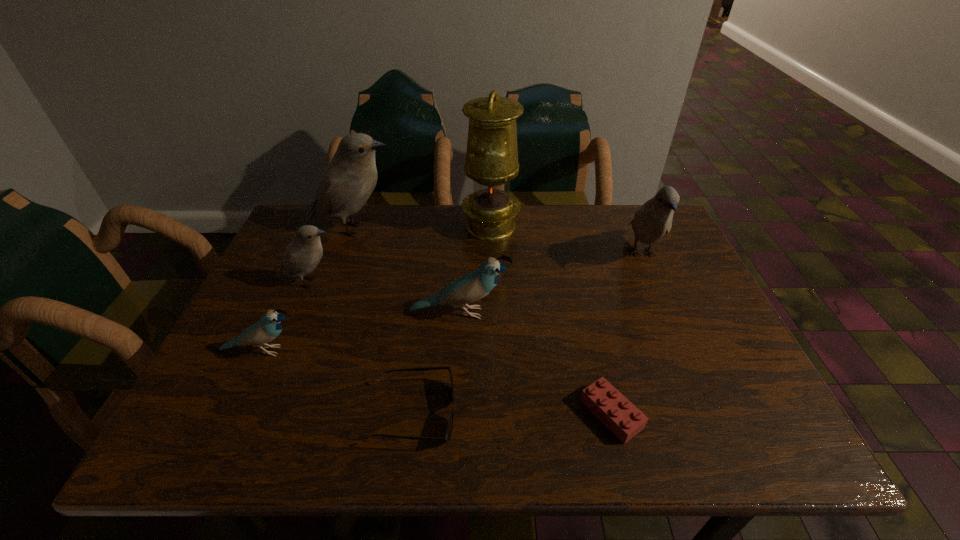
This screenshot has height=540, width=960. Find the location of `sunglasses`. sunglasses is located at coordinates (447, 436).

You are a GUI agent. You are given a task and a screenshot of the screen. Output one action in this format:
    pyautogui.click(x=<x>, y=<y>)
    Task: Click on the Lego
    The height and width of the screenshot is (540, 960).
    Given the screenshot: What is the action you would take?
    pyautogui.click(x=614, y=410)

The height and width of the screenshot is (540, 960). Find the location of `pink Lego`. pink Lego is located at coordinates (614, 410).

Locate an element on the screen. Image resolution: width=960 pixels, height=540 pixels. blank space located on the left of the tallest object is located at coordinates (340, 226).

At what (x,y) coordinates should I click in order to perform the action: click on vacant space located at the beak of the biggest white bird. Please return your answer as a coordinate pair (x, y). Looking at the image, I should click on (419, 229).

Locate an element on the screen. free space located 0.210m at the beak of the rightmost object is located at coordinates (680, 343).

I want to click on vacant space located at the beak of the smallest white bird, so point(398,282).

Identify the location of free point located at the face of the fourth nearest object. This screenshot has width=960, height=540. (637, 313).

The height and width of the screenshot is (540, 960). In order to click on vacant space located 0.230m at the face of the nearest bird in this screenshot , I will do `click(406, 351)`.

At what (x,y) coordinates should I click in order to perform the action: click on vacant area located on the lenses of the sunglasses. Please return your answer as a coordinate pair (x, y). Looking at the image, I should click on (623, 413).